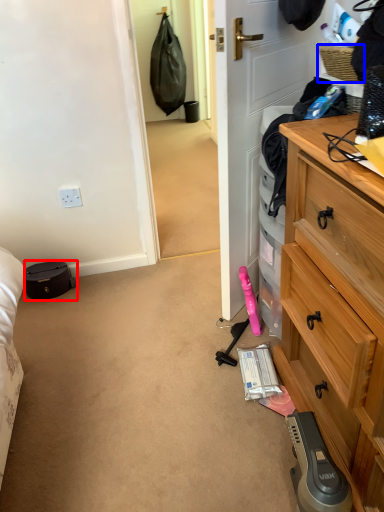
Question: Which object appears closest to the camera in this image, luggage and bags (highlighted by a red box) or picnic basket (highlighted by a blue box)?

Choices:
 (A) luggage and bags
 (B) picnic basket

Answer: (B)